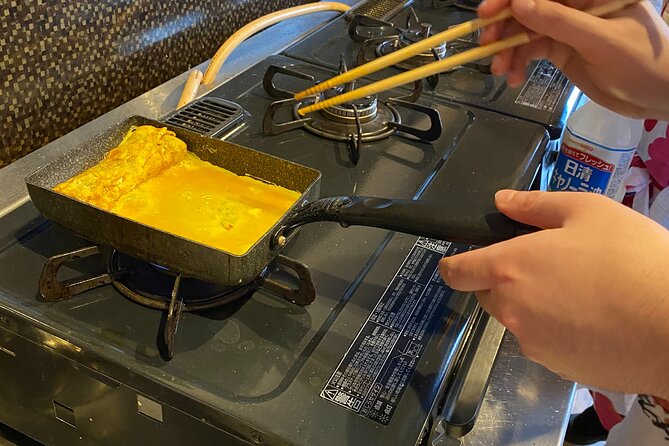
This screenshot has height=446, width=669. Find the location of `chopsticks`. chopsticks is located at coordinates (447, 32), (446, 62).